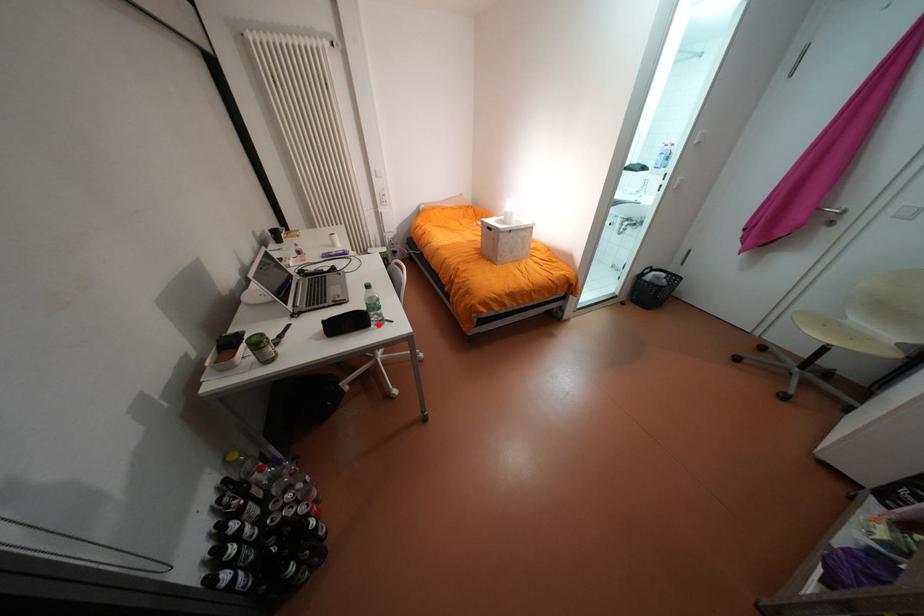
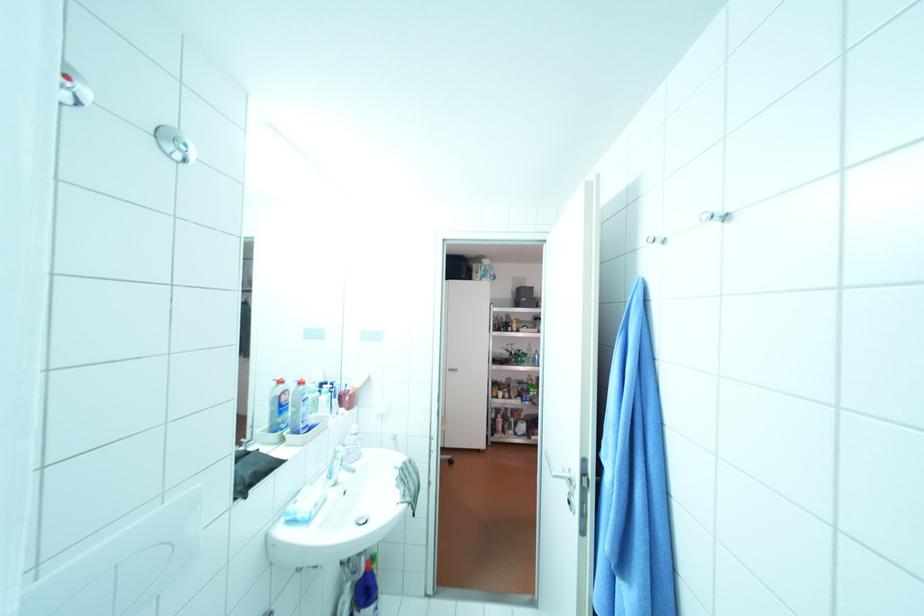
Question: I am providing you with two images of the same scene from different viewpoints. A red point is marked on the first image. At the location where the point appears in image 1, is it still visible in image 2?

Choices:
 (A) Yes
 (B) No

Answer: (B)